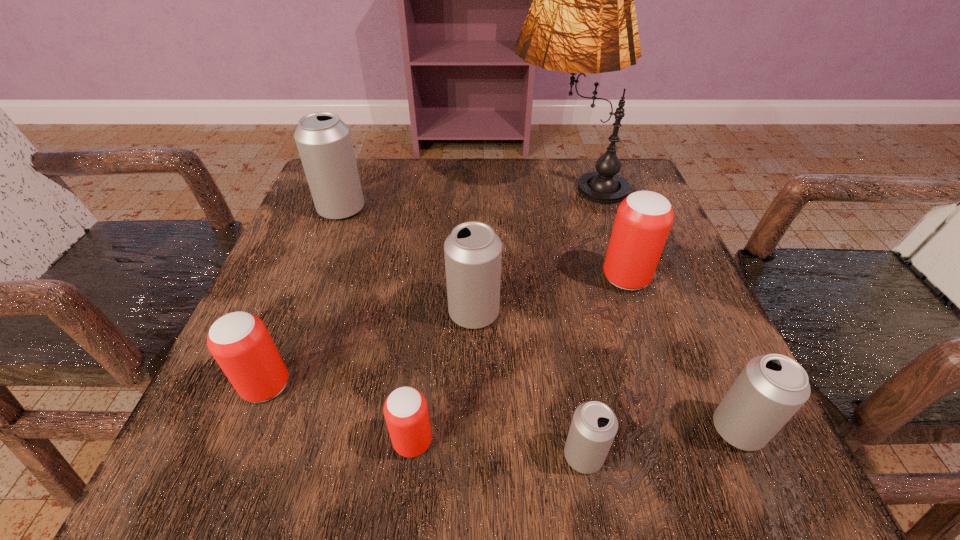
The image size is (960, 540). I want to click on the third closest beer can to the rightmost beer can, so click(473, 252).

Select which white beer can appears as the closest to the nearest red beer can. Please provide its 2D coordinates. Your answer should be formatted as a tuple, i.e. [(x, y)], where the tuple contains the x and y coordinates of a point satisfying the conditions above.

[(473, 252)]

Identify which white beer can is the second nearest to the lampshade. Please provide its 2D coordinates. Your answer should be formatted as a tuple, i.e. [(x, y)], where the tuple contains the x and y coordinates of a point satisfying the conditions above.

[(324, 143)]

Where is `red beer can that is the second closest to the smallest red beer can`? The height and width of the screenshot is (540, 960). red beer can that is the second closest to the smallest red beer can is located at coordinates tap(643, 220).

At what (x,y) coordinates should I click in order to perform the action: click on the closest red beer can to the second biggest red beer can. Please return your answer as a coordinate pair (x, y). Image resolution: width=960 pixels, height=540 pixels. Looking at the image, I should click on (405, 410).

The width and height of the screenshot is (960, 540). In order to click on free region that satisfies the following two spatial constraints: 1. on the front-facing side of the tallest object; 2. on the front side of the third nearest white beer can in this screenshot , I will do `click(599, 313)`.